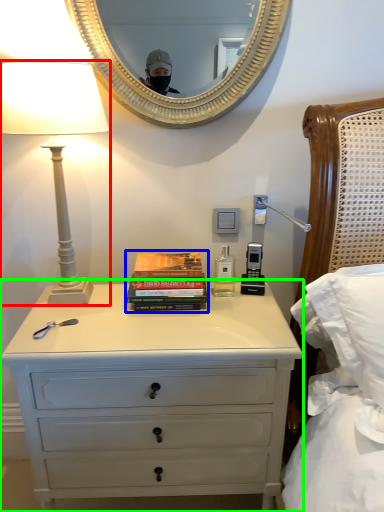
Question: Considering the real-world distances, which object is farthest from lamp (highlighted by a red box)? book (highlighted by a blue box) or chest of drawers (highlighted by a green box)?

Choices:
 (A) book
 (B) chest of drawers

Answer: (B)